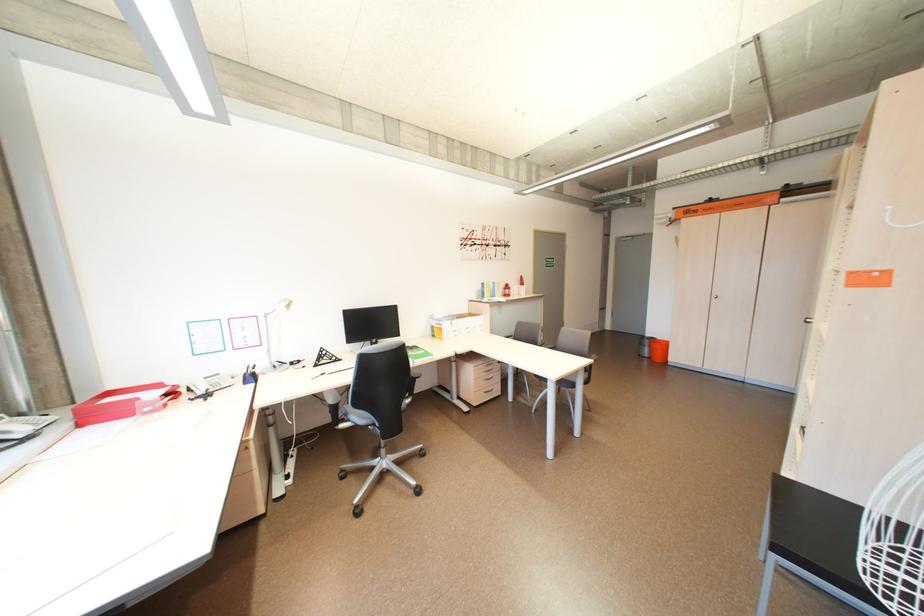
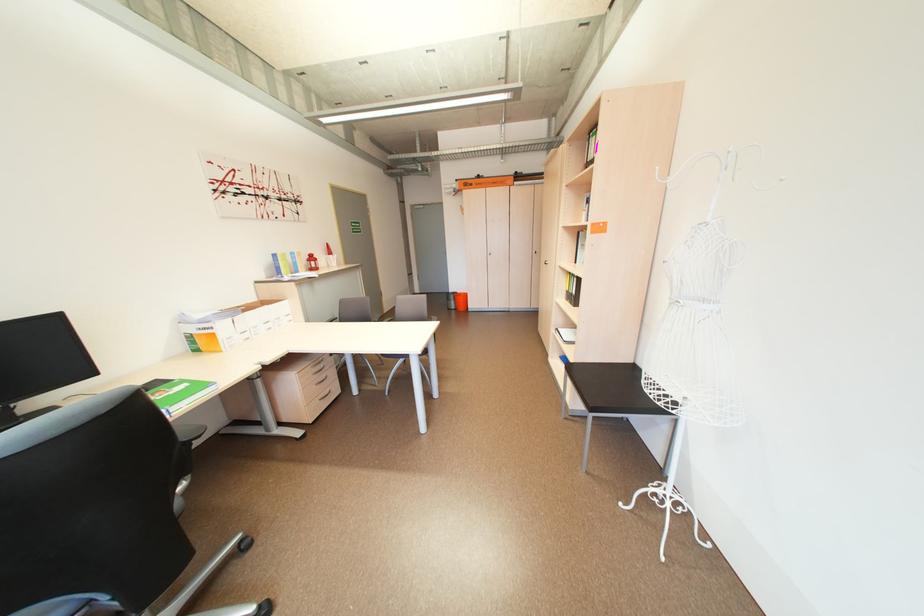
Where in the second image is the point corresponding to pixel 422 374 from the first image?

(193, 436)